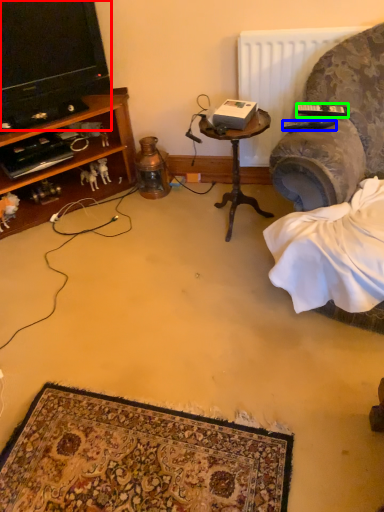
Question: Which is farther away from television (highlighted by a red box)? remote control (highlighted by a blue box) or remote control (highlighted by a green box)?

Choices:
 (A) remote control
 (B) remote control

Answer: (B)